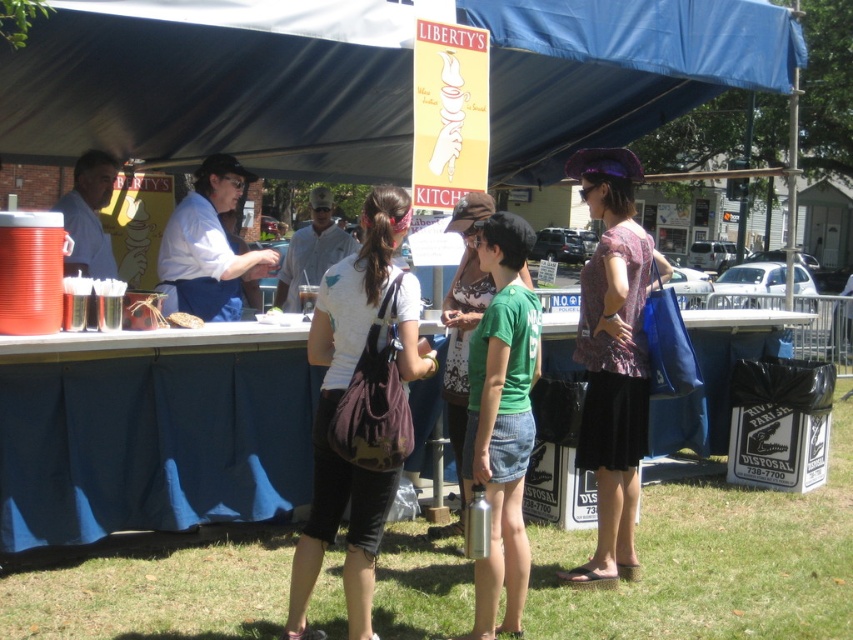
Consider the image. You are a photographer standing in front of the Liberty Kitchen booth. You want to take a photo that includes both the blue fabric canopy at upper center and the green fabric shirt at center. Which object should you focus on first to ensure both are in the frame?

The blue fabric canopy at upper center is further to the viewer than the green fabric shirt at center, so you should focus on the blue fabric canopy at upper center first to ensure both are in the frame.

You are a participant at the event and want to know if the blue fabric canopy at upper center can provide shade for the green fabric shirt at center. Based on their heights, can the canopy cover the shirt?

The blue fabric canopy at upper center has a lesser height compared to green fabric shirt at center, so it cannot provide sufficient shade to cover the shirt.